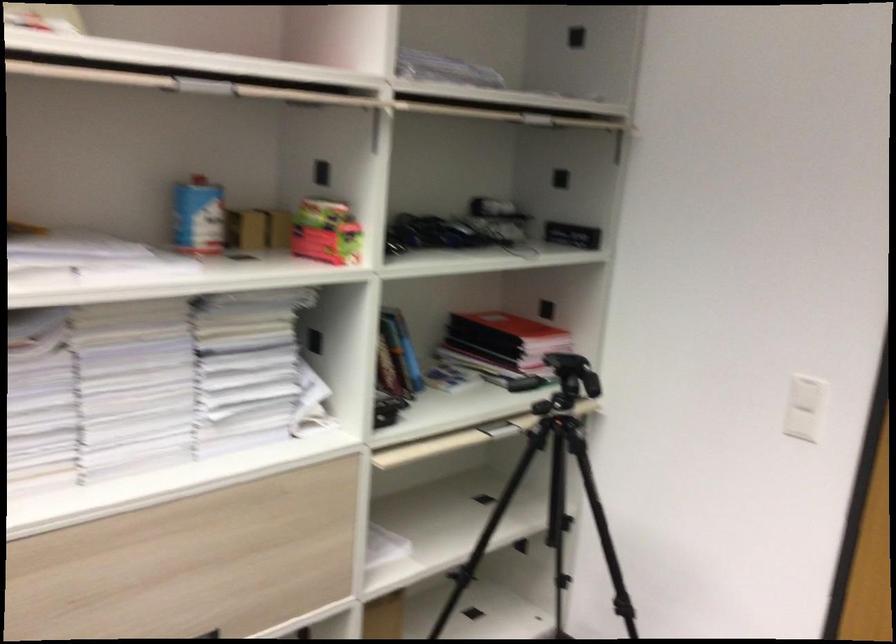
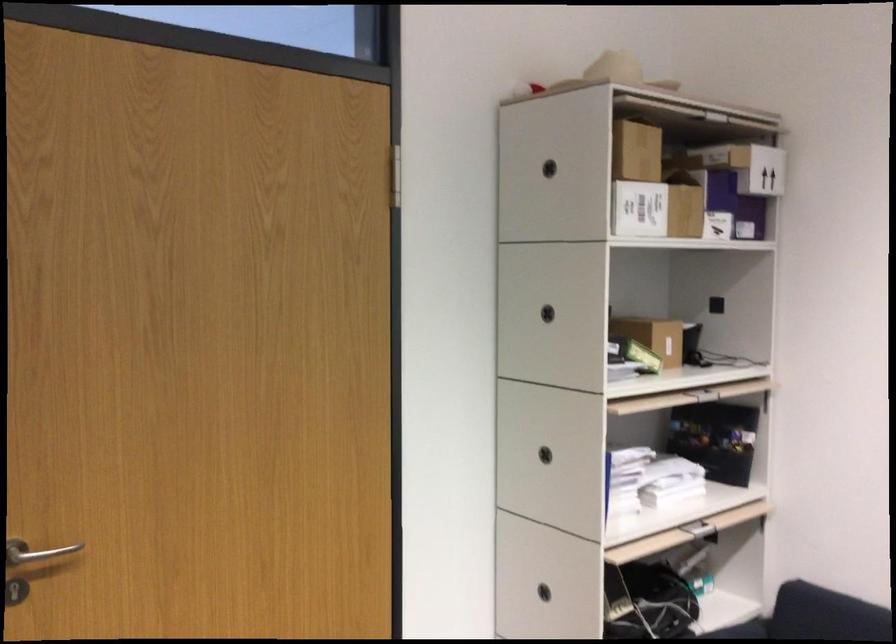
Question: Based on the continuous images, in which direction is the camera rotating? Reply with the corresponding letter.

Choices:
 (A) Left
 (B) Right
 (C) Up
 (D) Down

Answer: (B)